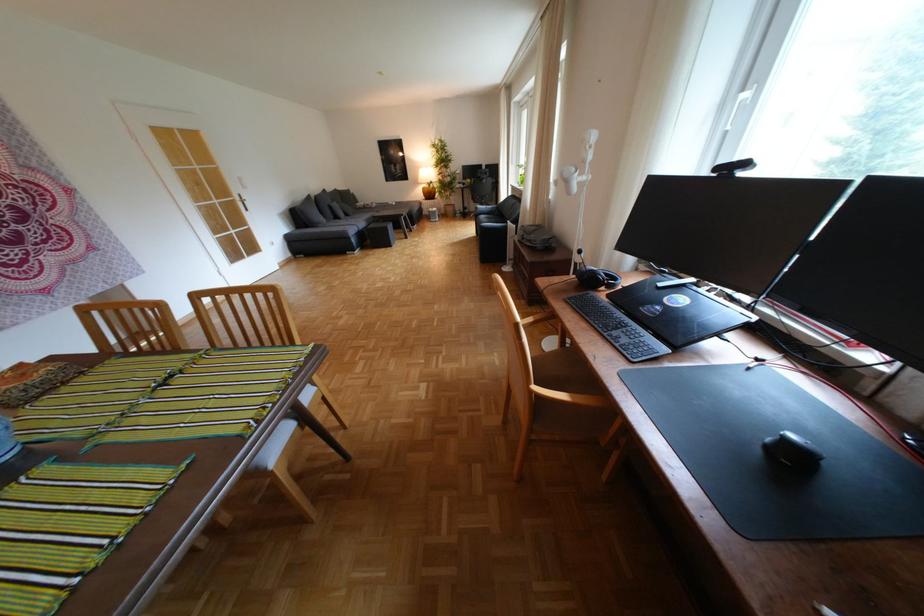
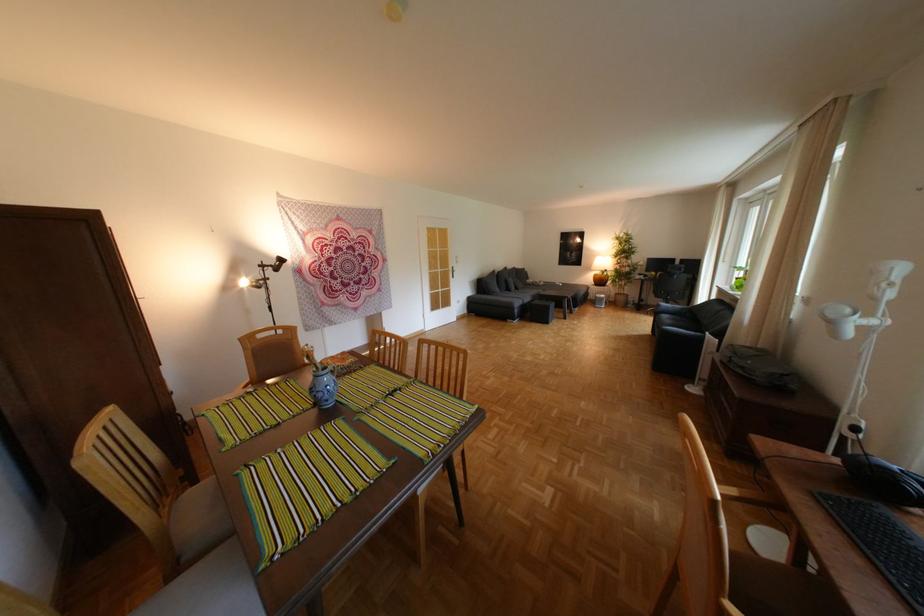
Where in the second image is the point corresponding to pixel 228 201 from the first image?

(453, 270)